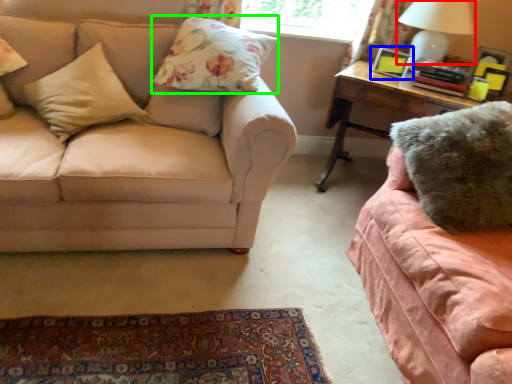
Question: Which object is the closest to the table lamp (highlighted by a red box)? Choose among these: picture frame (highlighted by a blue box) or pillow (highlighted by a green box).

Choices:
 (A) picture frame
 (B) pillow

Answer: (A)